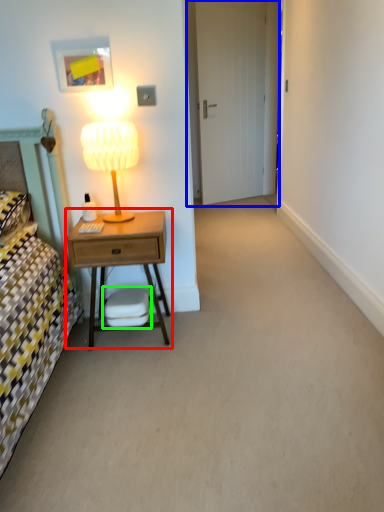
Question: Estimate the real-world distances between objects in this image. Which object is farther from nightstand (highlighted by a red box), door (highlighted by a blue box) or swivel chair (highlighted by a green box)?

Choices:
 (A) door
 (B) swivel chair

Answer: (A)